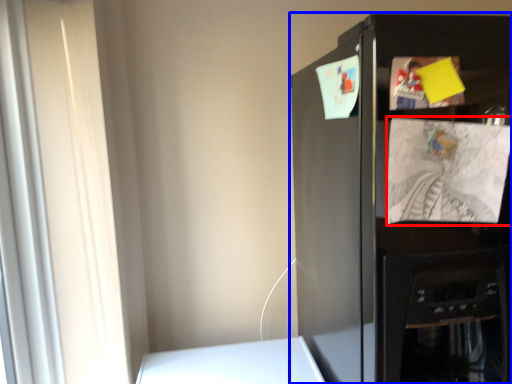
Question: Which object is further to the camera taking this photo, paper (highlighted by a red box) or refrigerator (highlighted by a blue box)?

Choices:
 (A) paper
 (B) refrigerator

Answer: (A)